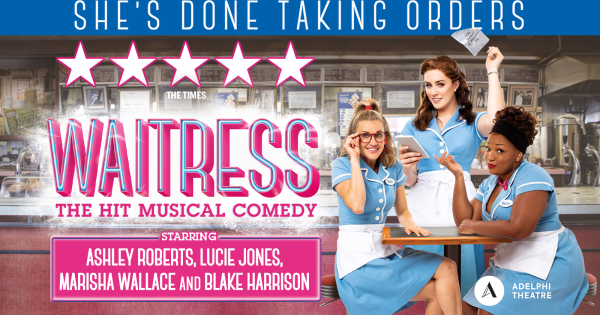
Where is `diner stool`? diner stool is located at coordinates (324, 288), (593, 281).